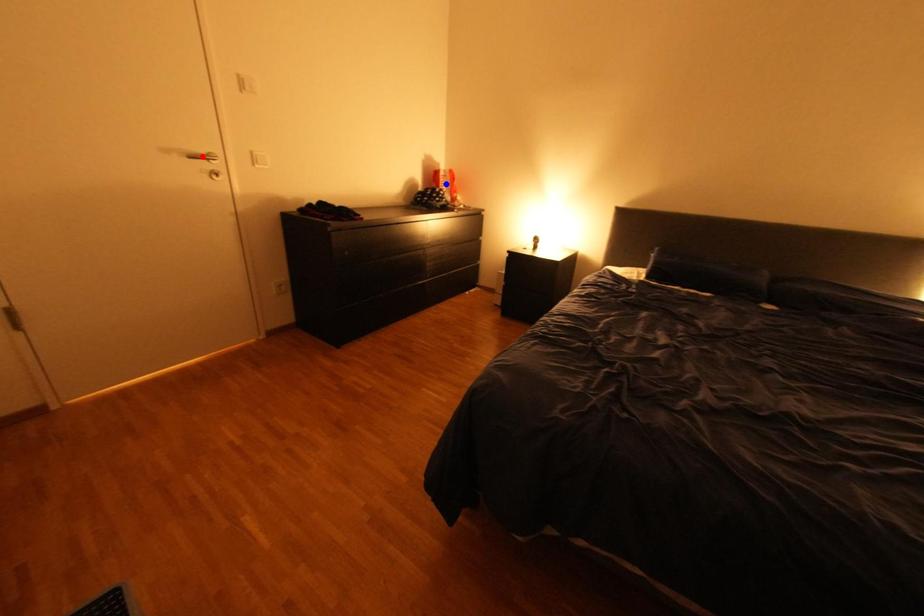
Question: Which of the two points in the image is closer to the camera?

Choices:
 (A) Blue point is closer.
 (B) Red point is closer.

Answer: (B)